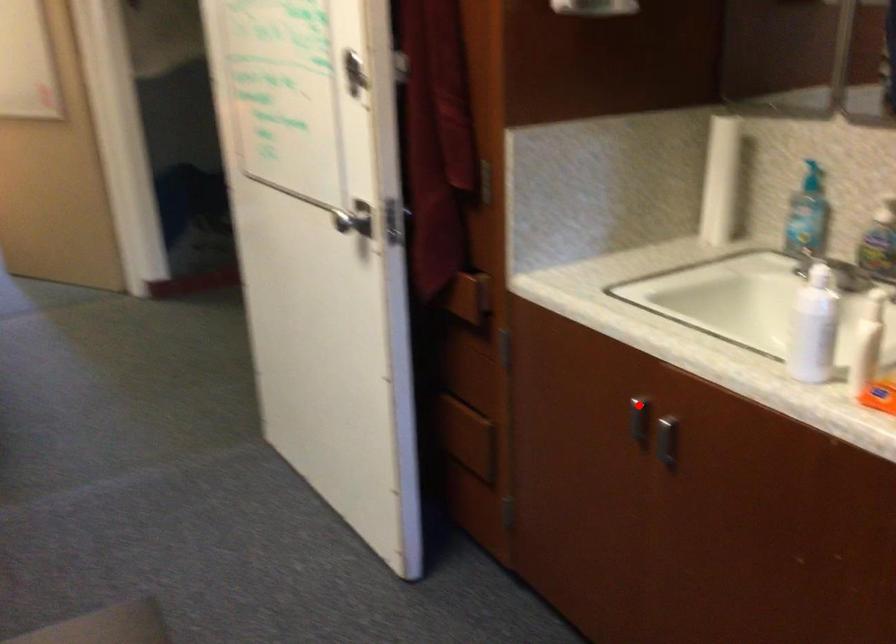
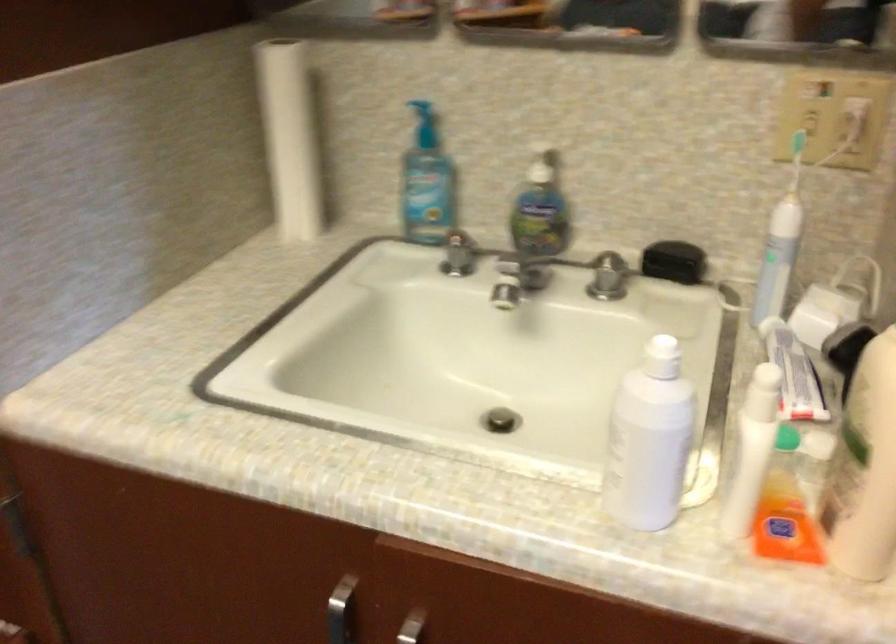
Question: I am providing you with two images of the same scene from different viewpoints. In image1, a red point is highlighted. Considering the same 3D point in image2, which of the following is correct?

Choices:
 (A) It is closer
 (B) It is farther

Answer: (A)